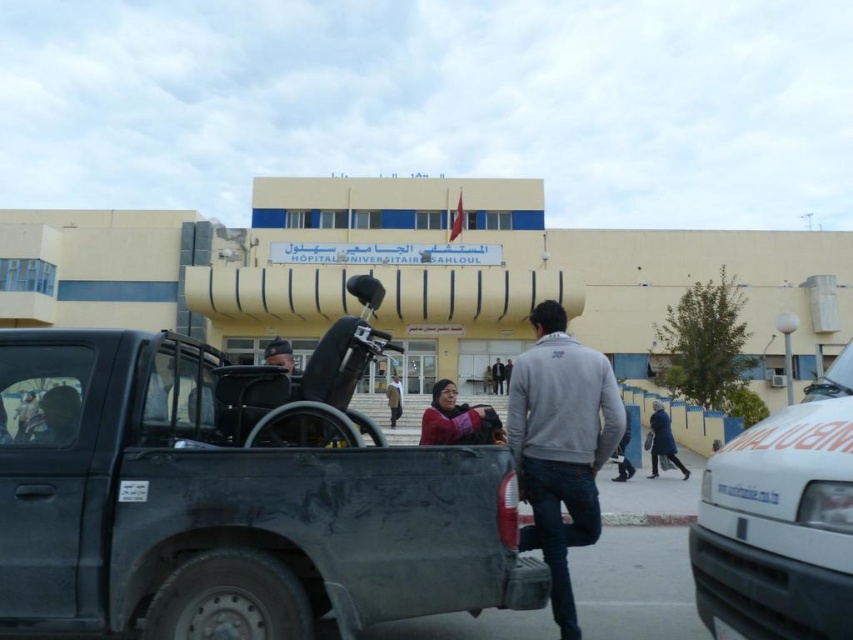
Which is in front, point (131, 486) or point (848, 596)?

Point (848, 596)

Between point (71, 618) and point (825, 380), which one is positioned in front?

Point (71, 618) is more forward.

The image size is (853, 640). In order to click on matte black truck at center in this screenshot , I will do `click(227, 502)`.

Is white matte van at right smaller than gray matte jacket at center?

Yes, white matte van at right is smaller than gray matte jacket at center.

Between point (834, 563) and point (585, 364), which one is positioned in front?

Point (834, 563)

Is point (773, 436) closer to viewer compared to point (561, 589)?

Yes, it is in front of point (561, 589).

The image size is (853, 640). Identify the location of white matte van at right. (780, 522).

Can you confirm if matte black truck at center is positioned above gray matte jacket at center?

Actually, matte black truck at center is below gray matte jacket at center.

Who is more forward, (x=260, y=602) or (x=548, y=554)?

Point (x=260, y=602)

Identify the location of matte black truck at center. (227, 502).